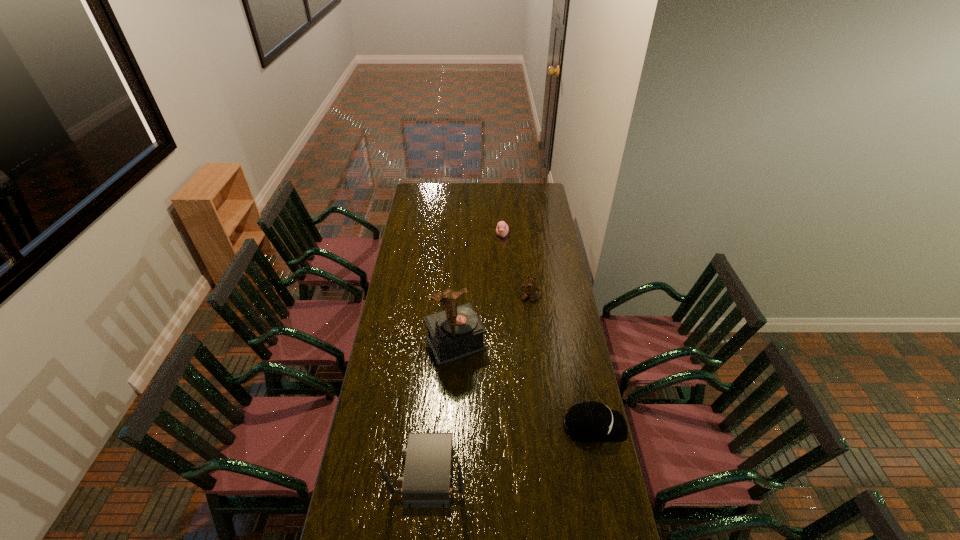
I want to click on empty space that is in between the farthest object and the third nearest object, so click(x=479, y=289).

Where is `unoccupied position between the farthest object and the fourth object from left to right`? unoccupied position between the farthest object and the fourth object from left to right is located at coordinates (516, 266).

In order to click on vacant region between the tallest object and the rightmost object in this screenshot , I will do `click(525, 385)`.

This screenshot has width=960, height=540. Identify the location of vacant region between the third nearest object and the fourth shortest object. (443, 407).

This screenshot has width=960, height=540. In order to click on free space between the second tallest object and the rightmost object in this screenshot , I will do `click(512, 448)`.

Locate which object is the second closest to the duckling. Please provide its 2D coordinates. Your answer should be formatted as a tuple, i.e. [(x, y)], where the tuple contains the x and y coordinates of a point satisfying the conditions above.

[(457, 332)]

What are the coordinates of `the second closest object to the rightmost object` in the screenshot? It's located at (426, 480).

Locate an element on the screen. This screenshot has height=540, width=960. vacant space that satisfies the following two spatial constraints: 1. on the front side of the cap; 2. on the front-facing side of the fourth object from left to right is located at coordinates (545, 426).